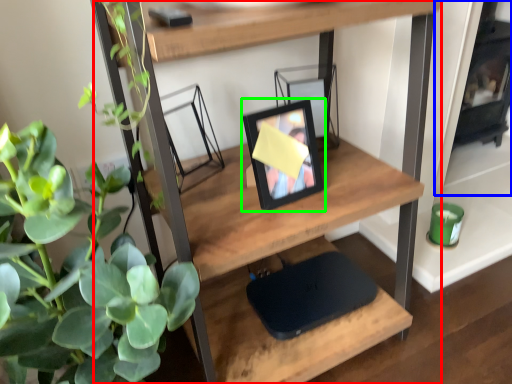
Question: Which object is the farthest from shelf (highlighted by a red box)? Choose among these: fireplace (highlighted by a blue box) or picture frame (highlighted by a green box).

Choices:
 (A) fireplace
 (B) picture frame

Answer: (A)